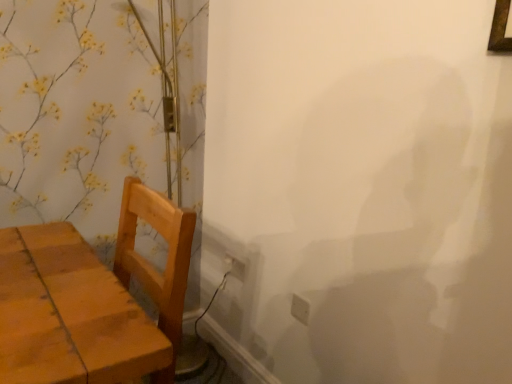
Question: From a real-world perspective, is white plastic electric outlet at lower center, positioned as the 1th electric outlet in back-to-front order, physically located above or below white plastic electric outlet at lower right, which is counted as the 1th electric outlet, starting from the right?

Choices:
 (A) below
 (B) above

Answer: (A)

Question: In terms of width, does white plastic electric outlet at lower center, arranged as the first electric outlet when viewed from the left, look wider or thinner when compared to white plastic electric outlet at lower right, which is counted as the 1th electric outlet, starting from the right?

Choices:
 (A) thin
 (B) wide

Answer: (A)

Question: Estimate the real-world distances between objects in this image. Which object is farther from the white plastic electric outlet at lower center, which is the 2th electric outlet in front-to-back order?

Choices:
 (A) white plastic electric outlet at lower right, which is counted as the 1th electric outlet, starting from the right
 (B) wooden table at left

Answer: (B)

Question: Which object is the farthest from the white plastic electric outlet at lower center, which is the 1th electric outlet from top to bottom?

Choices:
 (A) wooden table at left
 (B) white plastic electric outlet at lower right, the 2th electric outlet when ordered from left to right

Answer: (A)